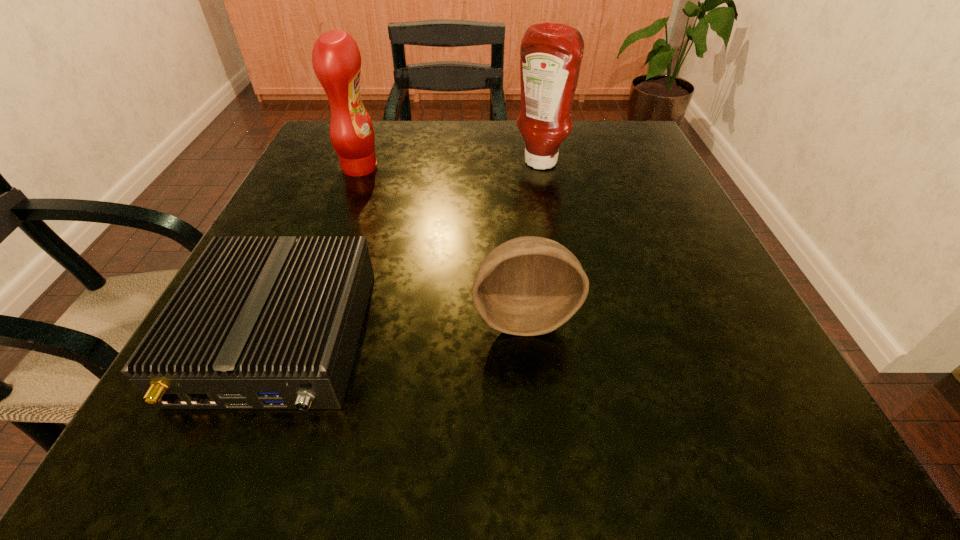
I want to click on object present at the far left corner, so click(x=336, y=59).

Image resolution: width=960 pixels, height=540 pixels. I want to click on object located in the near left corner section of the desktop, so click(x=258, y=323).

The height and width of the screenshot is (540, 960). What are the coordinates of `vacant space at the far edge of the desktop` in the screenshot? It's located at (564, 150).

At what (x,y) coordinates should I click in order to perform the action: click on vacant position at the near edge of the desktop. Please return your answer as a coordinate pair (x, y). This screenshot has height=540, width=960. Looking at the image, I should click on (614, 437).

The height and width of the screenshot is (540, 960). Find the location of `vacant area at the right edge of the desktop`. vacant area at the right edge of the desktop is located at coordinates (732, 383).

I want to click on vacant region at the far left corner of the desktop, so click(x=335, y=161).

You are a GUI agent. You are given a task and a screenshot of the screen. Output one action in this format:
    pyautogui.click(x=<x>, y=<y>)
    Task: Click on the vacant space at the far right corner of the desktop
    
    Given the screenshot: What is the action you would take?
    pyautogui.click(x=581, y=144)

In order to click on vacant space that is in between the left condiment and the bowl in this screenshot , I will do `click(442, 242)`.

Locate an element on the screen. Image resolution: width=960 pixels, height=540 pixels. free area in between the right condiment and the router is located at coordinates (410, 251).

You are a GUI agent. You are given a task and a screenshot of the screen. Output one action in this format:
    pyautogui.click(x=<x>, y=<y>)
    Task: Click on the unoccupied position between the left condiment and the bowl
    
    Given the screenshot: What is the action you would take?
    pyautogui.click(x=442, y=242)